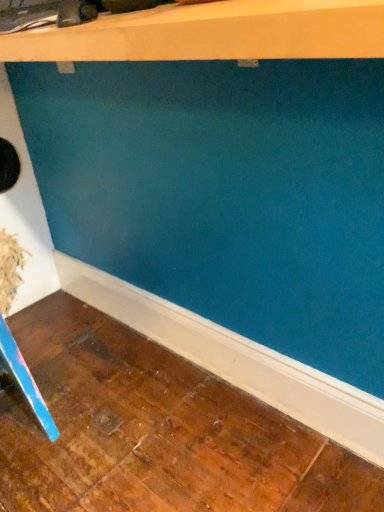
Question: Are matte white shelf at upper center and blue plastic ruler at lower left making contact?

Choices:
 (A) yes
 (B) no

Answer: (B)

Question: Is matte white shelf at upper center outside blue plastic ruler at lower left?

Choices:
 (A) no
 (B) yes

Answer: (B)

Question: Considering the relative positions of matte white shelf at upper center and blue plastic ruler at lower left in the image provided, is matte white shelf at upper center to the left of blue plastic ruler at lower left from the viewer's perspective?

Choices:
 (A) yes
 (B) no

Answer: (B)

Question: Could you tell me if matte white shelf at upper center is turned towards blue plastic ruler at lower left?

Choices:
 (A) no
 (B) yes

Answer: (A)

Question: From the image's perspective, is matte white shelf at upper center under blue plastic ruler at lower left?

Choices:
 (A) no
 (B) yes

Answer: (A)

Question: Does matte white shelf at upper center lie in front of blue plastic ruler at lower left?

Choices:
 (A) yes
 (B) no

Answer: (A)

Question: Does blue plastic ruler at lower left have a smaller size compared to matte white shelf at upper center?

Choices:
 (A) yes
 (B) no

Answer: (A)

Question: Is blue plastic ruler at lower left surrounding matte white shelf at upper center?

Choices:
 (A) no
 (B) yes

Answer: (A)

Question: Considering the relative positions of blue plastic ruler at lower left and matte white shelf at upper center in the image provided, is blue plastic ruler at lower left in front of matte white shelf at upper center?

Choices:
 (A) no
 (B) yes

Answer: (A)

Question: Can you see blue plastic ruler at lower left touching matte white shelf at upper center?

Choices:
 (A) yes
 (B) no

Answer: (B)

Question: Is blue plastic ruler at lower left thinner than matte white shelf at upper center?

Choices:
 (A) yes
 (B) no

Answer: (A)

Question: Can you confirm if blue plastic ruler at lower left is positioned to the right of matte white shelf at upper center?

Choices:
 (A) yes
 (B) no

Answer: (B)

Question: Relative to blue plastic ruler at lower left, is matte white shelf at upper center in front or behind?

Choices:
 (A) behind
 (B) front

Answer: (B)